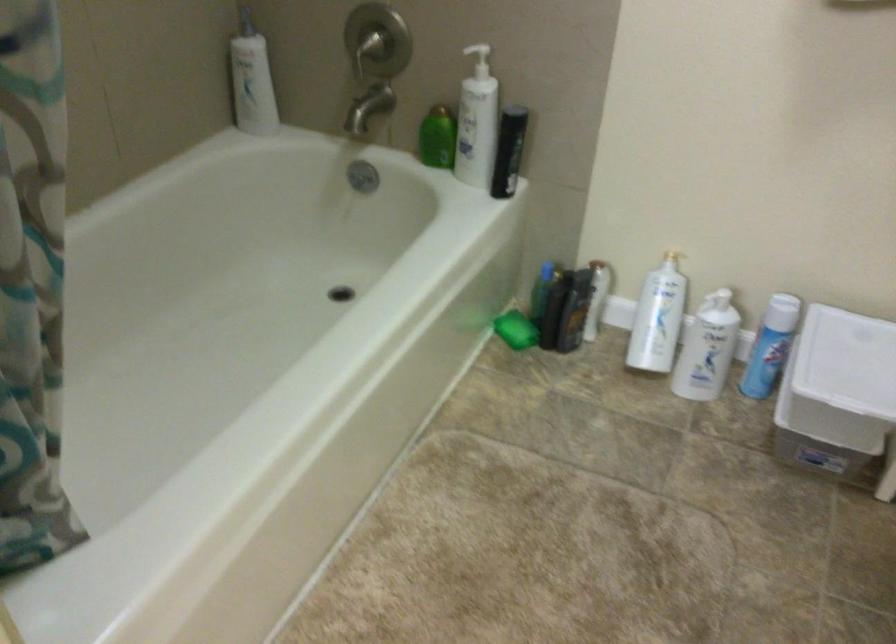
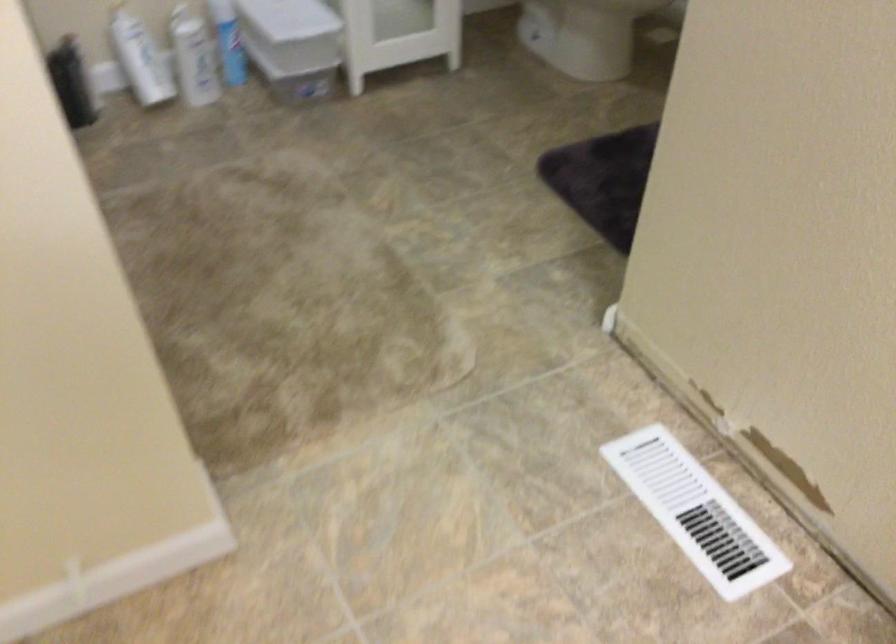
Where in the second image is the point corresponding to the point at 639,317 from the first image?

(140, 59)